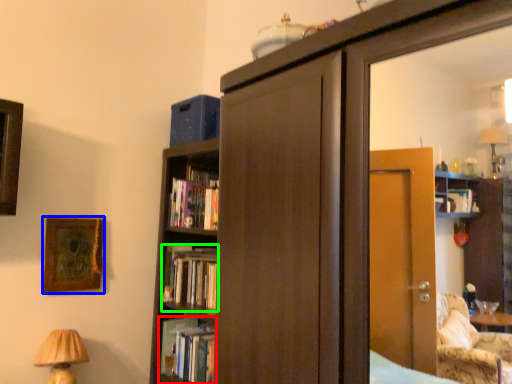
Question: Considering the real-world distances, which object is farthest from book (highlighted by a red box)? picture frame (highlighted by a blue box) or book (highlighted by a green box)?

Choices:
 (A) picture frame
 (B) book

Answer: (A)